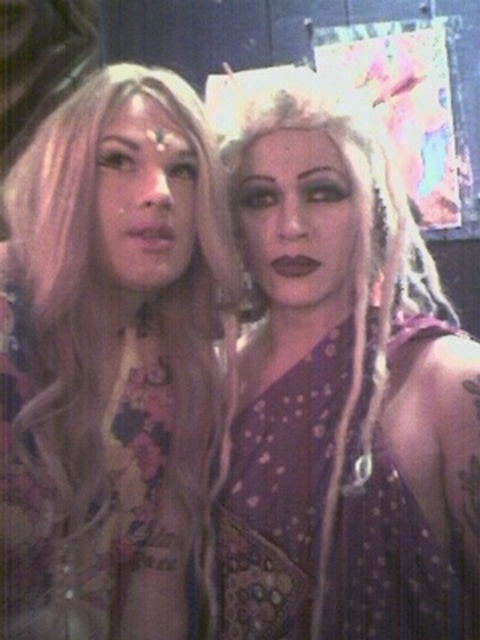
You are a photographer setting up a shoot. You have a matte purple dress at center and a blonde hair at center in your frame. Which object occupies more visual space in the composition?

The matte purple dress at center is larger in size than the blonde hair at center, so it occupies more visual space in the composition.

You are a photographer setting up a shoot for a fashion magazine. You want to position a spotlight to highlight both the matte purple dress at center and the blonde hair at center without overlapping their light. Since the dress is to the right of the hair, where should you place the spotlight?

The matte purple dress at center is to the right of the blonde hair at center, so place the spotlight between them, slightly to the left of the dress and right of the hair to ensure both are highlighted without overlapping light.

You are a fashion designer trying to locate the matte purple dress at center in the image. Where exactly is it positioned in the image?

The matte purple dress at center is located at point (343, 387).